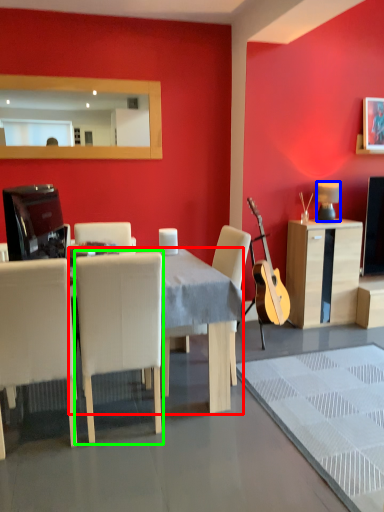
Question: Considering the real-world distances, which object is closest to desk (highlighted by a red box)? lamp (highlighted by a blue box) or chair (highlighted by a green box).

Choices:
 (A) lamp
 (B) chair

Answer: (B)